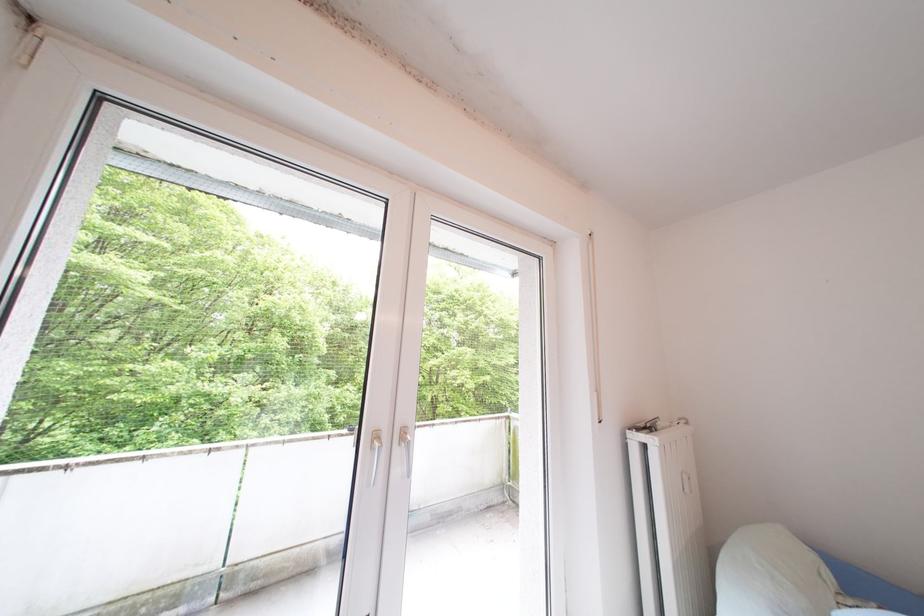
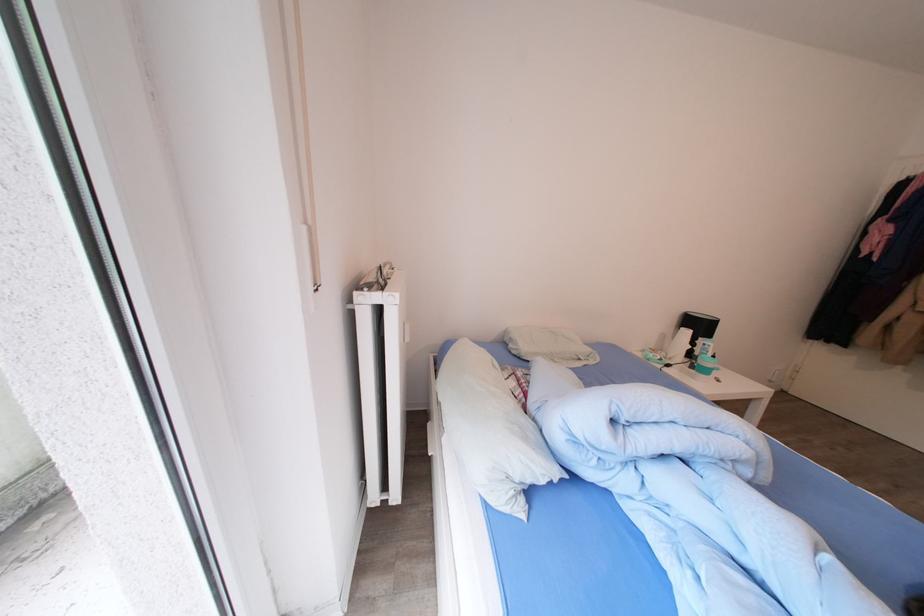
Based on the continuous images, in which direction is the camera rotating?

The camera's rotation is toward right-down.